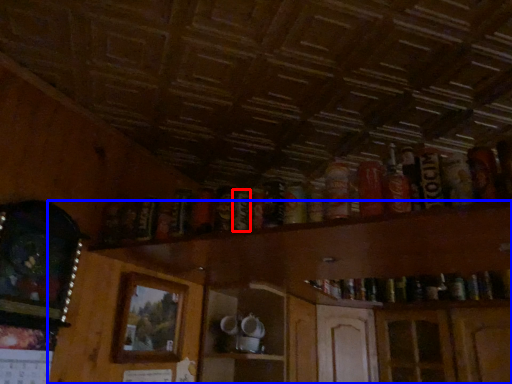
Question: Among these objects, which one is farthest to the camera, beer (highlighted by a red box) or dresser (highlighted by a blue box)?

Choices:
 (A) beer
 (B) dresser

Answer: (A)